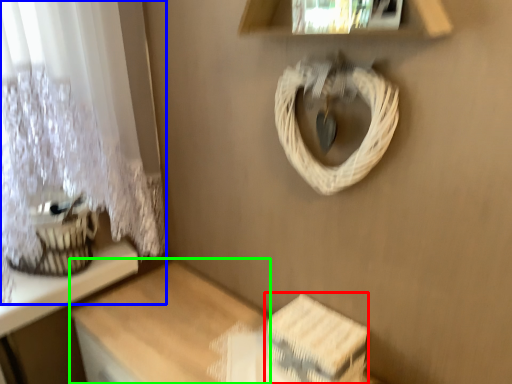
Question: Which is nearer to the storage box (highlighted by a red box)? curtain (highlighted by a blue box) or table (highlighted by a green box).

Choices:
 (A) curtain
 (B) table

Answer: (B)